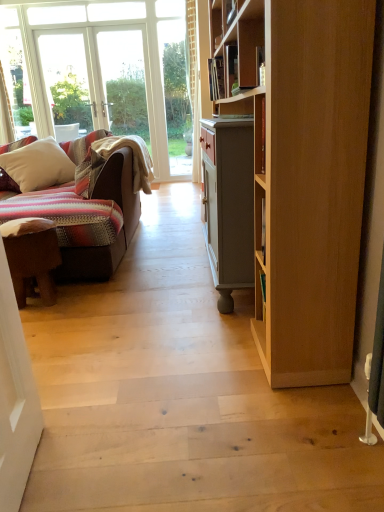
Question: From the image's perspective, is brown leather stool at left below white soft pillow at left?

Choices:
 (A) no
 (B) yes

Answer: (B)

Question: From a real-world perspective, is brown leather stool at left positioned over white soft pillow at left based on gravity?

Choices:
 (A) no
 (B) yes

Answer: (A)

Question: Is brown leather stool at left to the right of white soft pillow at left from the viewer's perspective?

Choices:
 (A) no
 (B) yes

Answer: (B)

Question: Is brown leather stool at left thinner than white soft pillow at left?

Choices:
 (A) no
 (B) yes

Answer: (B)

Question: From the image's perspective, is brown leather stool at left on top of white soft pillow at left?

Choices:
 (A) yes
 (B) no

Answer: (B)

Question: Can you confirm if brown leather stool at left is positioned to the left of white soft pillow at left?

Choices:
 (A) yes
 (B) no

Answer: (B)

Question: From a real-world perspective, is white soft pillow at left located higher than brown leather stool at left?

Choices:
 (A) no
 (B) yes

Answer: (B)

Question: Would you say white soft pillow at left is a long distance from brown leather stool at left?

Choices:
 (A) no
 (B) yes

Answer: (B)

Question: Is white soft pillow at left looking in the opposite direction of brown leather stool at left?

Choices:
 (A) no
 (B) yes

Answer: (A)

Question: Does white soft pillow at left have a lesser width compared to brown leather stool at left?

Choices:
 (A) yes
 (B) no

Answer: (B)

Question: Considering the relative positions of white soft pillow at left and brown leather stool at left in the image provided, is white soft pillow at left to the right of brown leather stool at left from the viewer's perspective?

Choices:
 (A) yes
 (B) no

Answer: (B)

Question: From the image's perspective, is white soft pillow at left on brown leather stool at left?

Choices:
 (A) no
 (B) yes

Answer: (B)

Question: In terms of height, does white soft pillow at left look taller or shorter compared to brown leather stool at left?

Choices:
 (A) short
 (B) tall

Answer: (B)